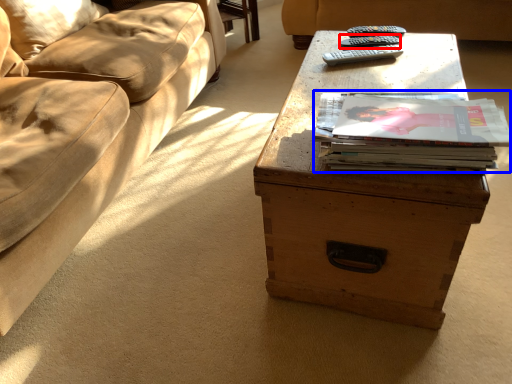
Question: Which of the following is the farthest to the observer, remote (highlighted by a red box) or paperback book (highlighted by a blue box)?

Choices:
 (A) remote
 (B) paperback book

Answer: (A)